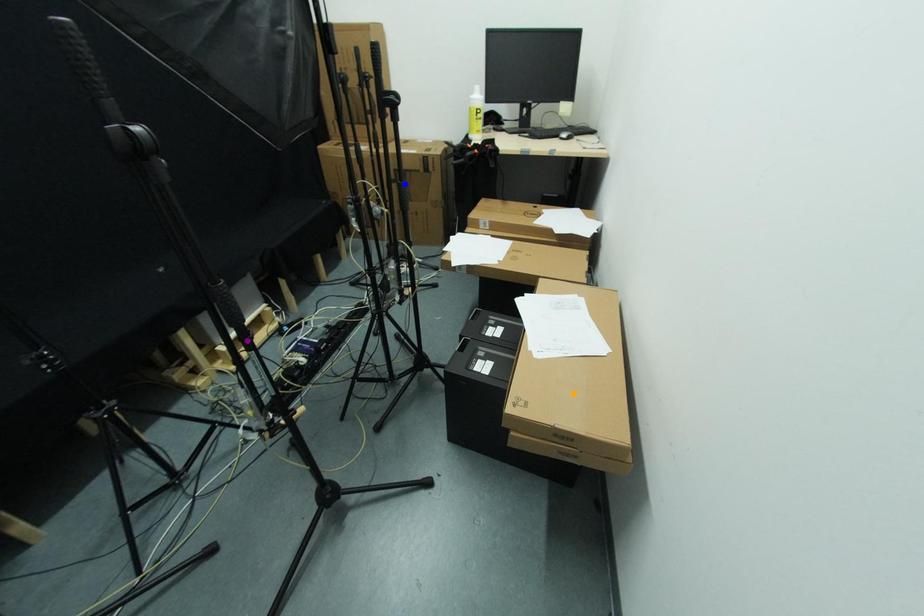
Order these from farthest to nearest:
purple point | blue point | orange point

blue point
purple point
orange point